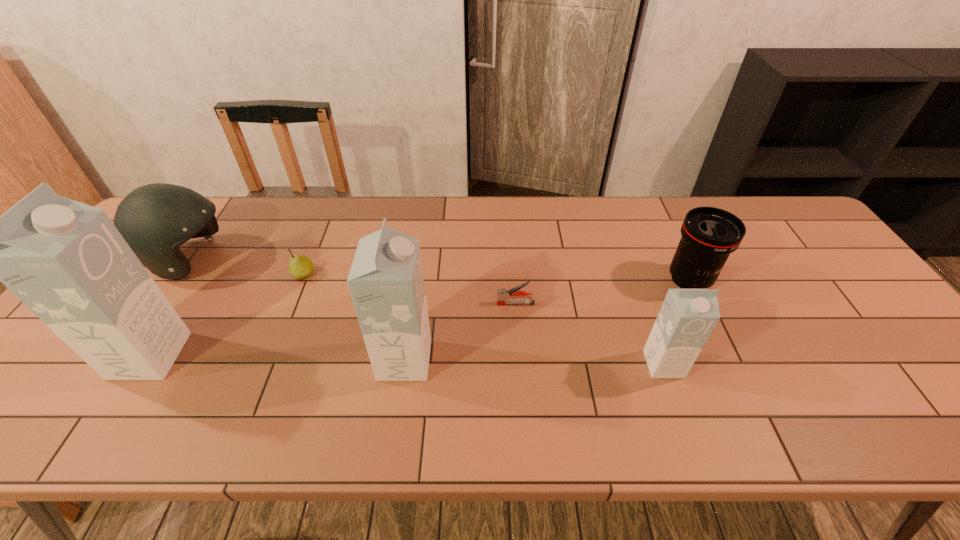
The image size is (960, 540). I want to click on free spot between the stapler and the second shortest carton, so click(x=460, y=332).

Identify the location of vacant region between the leftmost carton and the third object from left to right. The width and height of the screenshot is (960, 540). (227, 315).

Identify the location of object that is the fifth closest to the sixth tallest object. (687, 317).

You are a GUI agent. You are given a task and a screenshot of the screen. Output one action in this format:
    pyautogui.click(x=<x>, y=<y>)
    Task: Click on the object that is the second closest one to the pear
    This screenshot has width=960, height=540.
    Given the screenshot: What is the action you would take?
    pyautogui.click(x=66, y=261)

Select which carton is the closest to the shortest carton. Please provide its 2D coordinates. Your answer should be formatted as a tuple, i.e. [(x, y)], where the tuple contains the x and y coordinates of a point satisfying the conditions above.

[(386, 282)]

Identify the location of the closest carton to the second tallest carton. Image resolution: width=960 pixels, height=540 pixels. (66, 261).

The image size is (960, 540). I want to click on free space that satisfies the following two spatial constraints: 1. on the front side of the third shortest object; 2. on the handle side of the fourth nearest object, so click(701, 303).

The image size is (960, 540). Find the location of `free space that satisfies the following two spatial constraints: 1. at the face opening of the second shortest object; 2. on the right side of the football helmet`. free space that satisfies the following two spatial constraints: 1. at the face opening of the second shortest object; 2. on the right side of the football helmet is located at coordinates (180, 274).